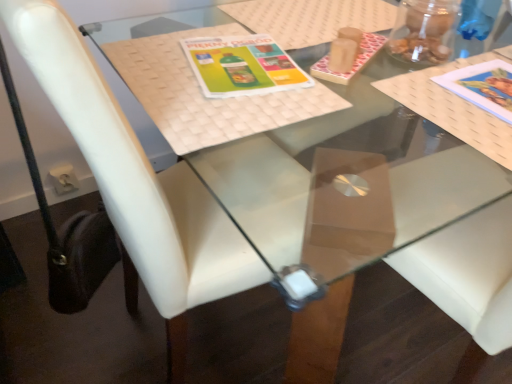
Locate an element on the screen. Image resolution: width=512 pixels, height=384 pixels. free space to the left of matte green plastic book cover at center, placed as the 2th book cover when sorted from right to left is located at coordinates (153, 63).